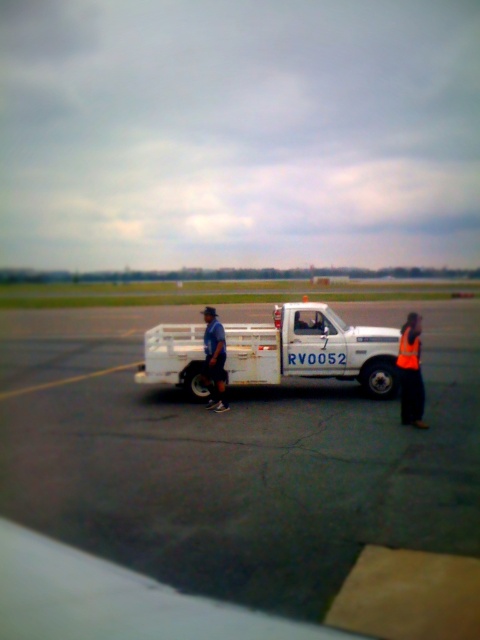
Question: Among these points, which one is nearest to the camera?

Choices:
 (A) (41, 424)
 (B) (243, 328)
 (C) (428, 426)

Answer: (C)

Question: Is white matte truck at center above reflective orange vest at center?

Choices:
 (A) yes
 (B) no

Answer: (B)

Question: Is white smooth tarmac at center bigger than white matte truck at center?

Choices:
 (A) yes
 (B) no

Answer: (A)

Question: Observing the image, what is the correct spatial positioning of reflective orange vest at center in reference to orange fabric safety vest at right?

Choices:
 (A) left
 (B) right

Answer: (B)

Question: Which point appears closest to the camera in this image?

Choices:
 (A) (409, 365)
 (B) (123, 371)

Answer: (A)

Question: Which point is closer to the camera taking this photo?

Choices:
 (A) (391, 390)
 (B) (408, 333)
 (C) (412, 342)

Answer: (C)